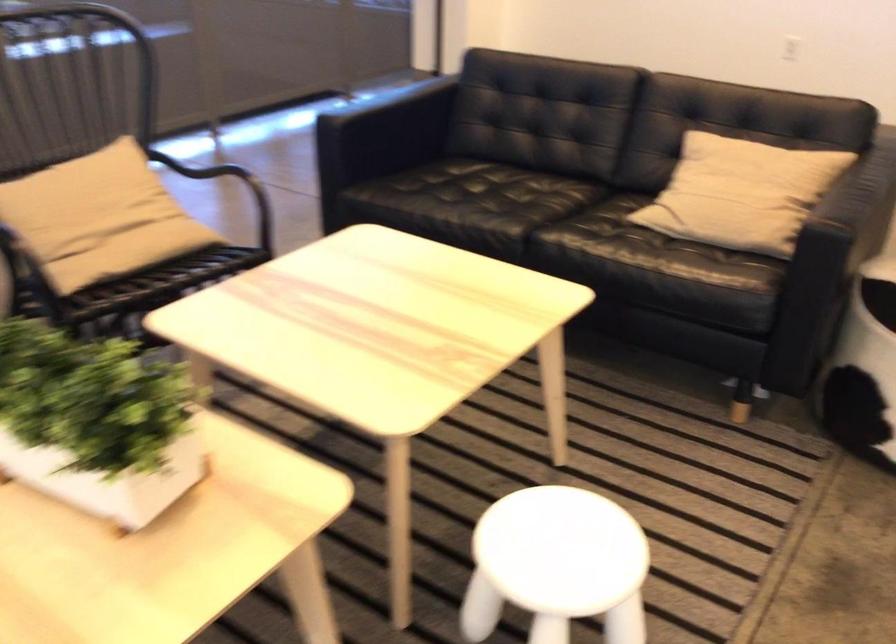
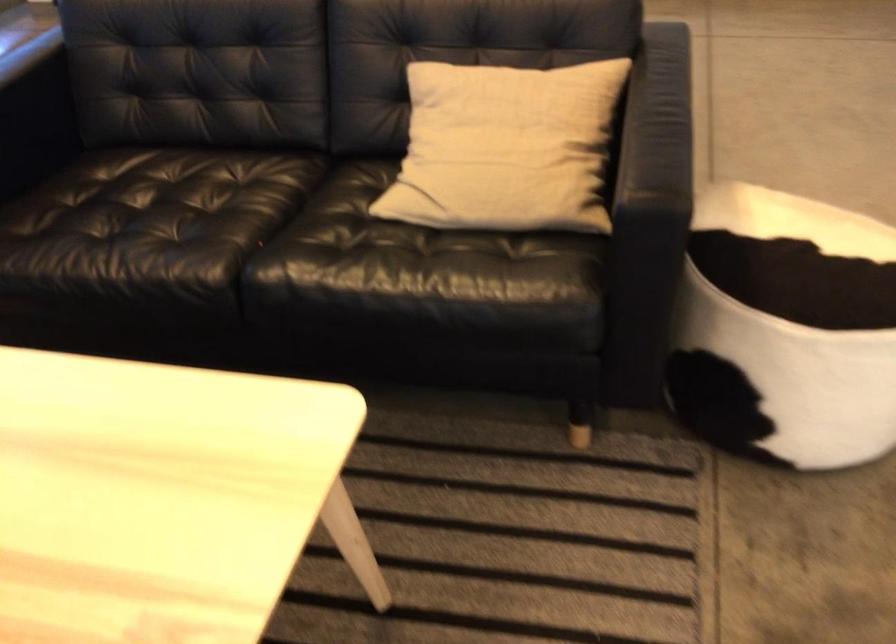
Question: The images are taken continuously from a first-person perspective. In which direction is your viewpoint rotating?

Choices:
 (A) Left
 (B) Right
 (C) Up
 (D) Down

Answer: (B)